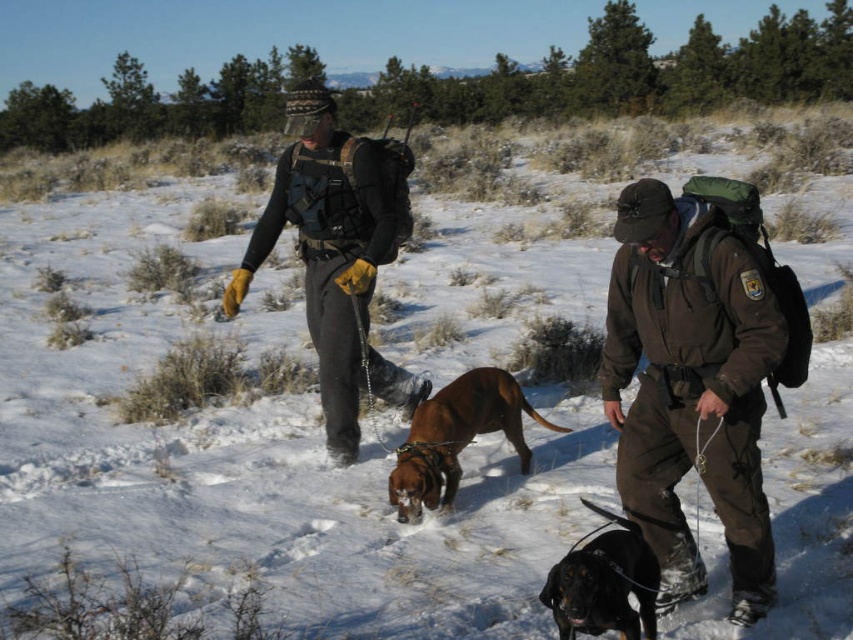
Question: Observing the image, what is the correct spatial positioning of brown matte uniform at center in reference to brown leather dog at center?

Choices:
 (A) left
 (B) right

Answer: (B)

Question: Which of the following is the closest to the observer?

Choices:
 (A) (374, 157)
 (B) (526, 406)
 (C) (764, 552)

Answer: (C)

Question: Considering the real-world distances, which object is closest to the brown matte uniform at center?

Choices:
 (A) black smooth dog at lower center
 (B) brown leather dog at center

Answer: (A)

Question: Can you confirm if brown matte uniform at center is thinner than black smooth dog at lower center?

Choices:
 (A) yes
 (B) no

Answer: (B)

Question: Does brown matte uniform at center have a greater width compared to brown leather dog at center?

Choices:
 (A) yes
 (B) no

Answer: (B)

Question: Which of the following is the farthest from the observer?

Choices:
 (A) click(x=393, y=492)
 (B) click(x=708, y=371)

Answer: (A)